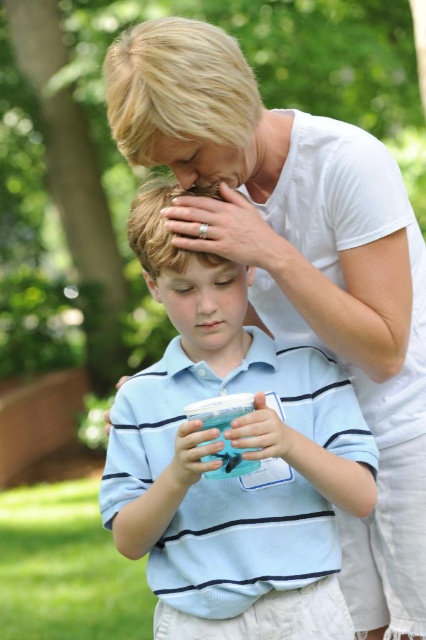
Question: Does translucent plastic cup at center have a greater width compared to matte plastic cup at lower center?

Choices:
 (A) no
 (B) yes

Answer: (A)

Question: Estimate the real-world distances between objects in this image. Which object is farther from the translucent plastic cup at center?

Choices:
 (A) matte plastic cup at lower center
 (B) blue translucent cup at center
 (C) blue striped polo shirt at center
 (D) matte white hand at upper center

Answer: (A)

Question: Considering the relative positions of blue striped polo shirt at center and translucent plastic cup at center in the image provided, where is blue striped polo shirt at center located with respect to translucent plastic cup at center?

Choices:
 (A) above
 (B) below

Answer: (A)

Question: Considering the relative positions of matte white hand at upper center and matte plastic cup at lower center in the image provided, where is matte white hand at upper center located with respect to matte plastic cup at lower center?

Choices:
 (A) left
 (B) right

Answer: (B)

Question: Based on their relative distances, which object is farther from the blue striped polo shirt at center?

Choices:
 (A) blue translucent cup at center
 (B) matte white hand at upper center
 (C) translucent plastic cup at center
 (D) matte plastic cup at lower center

Answer: (D)

Question: Which object is the closest to the matte white hand at upper center?

Choices:
 (A) translucent plastic cup at center
 (B) blue translucent cup at center

Answer: (B)